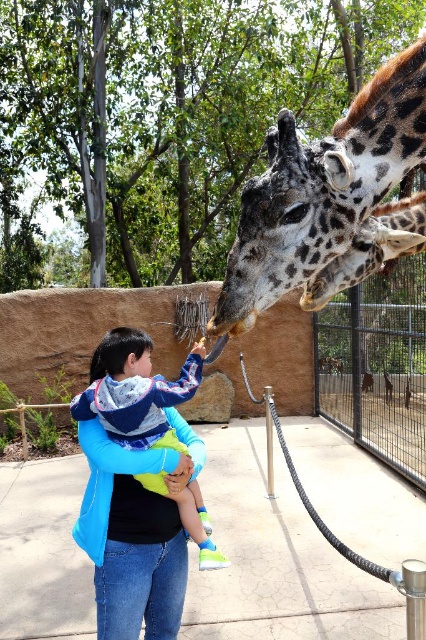
Which is more to the right, spotted fur giraffe at upper center or metal wire fence at center?

metal wire fence at center

Who is shorter, spotted fur giraffe at upper center or metal wire fence at center?

spotted fur giraffe at upper center is shorter.

Who is more distant from viewer, (385, 113) or (411, 308)?

The point (411, 308) is more distant.

Where is `spotted fur giraffe at upper center`? The width and height of the screenshot is (426, 640). spotted fur giraffe at upper center is located at coordinates (330, 200).

Which is below, spotted fur giraffe at upper center or spotted fur giraffe at center?

spotted fur giraffe at center

Is the position of spotted fur giraffe at upper center more distant than that of spotted fur giraffe at center?

No.

This screenshot has width=426, height=640. I want to click on spotted fur giraffe at upper center, so click(x=330, y=200).

Does metal wire fence at center have a larger size compared to blue fleece jacket at center?

Correct, metal wire fence at center is larger in size than blue fleece jacket at center.

Who is positioned more to the left, metal wire fence at center or blue fleece jacket at center?

blue fleece jacket at center is more to the left.

What do you see at coordinates (377, 365) in the screenshot?
I see `metal wire fence at center` at bounding box center [377, 365].

This screenshot has width=426, height=640. Identify the location of metal wire fence at center. (377, 365).